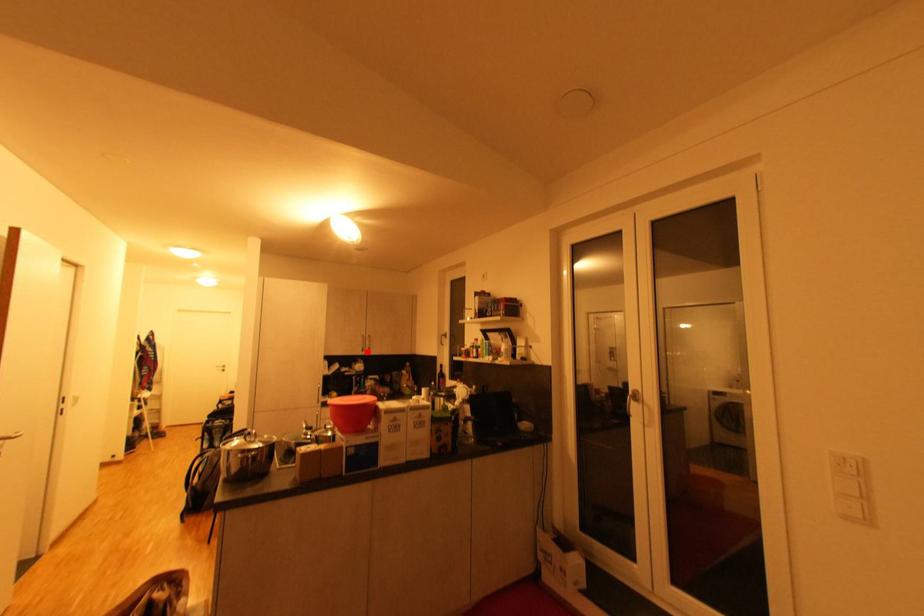
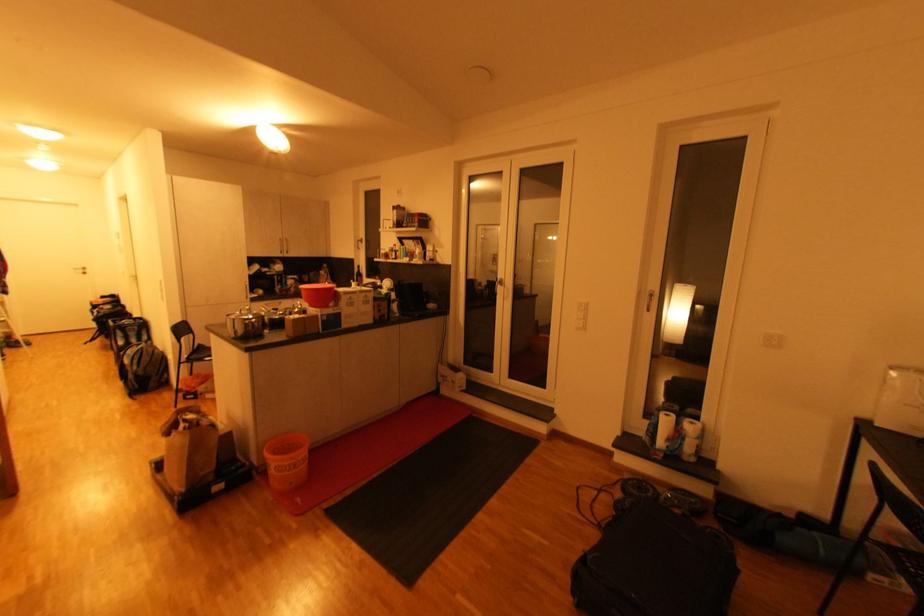
In the second image, find the point that corresponds to the highlighted location in the first image.

(286, 254)